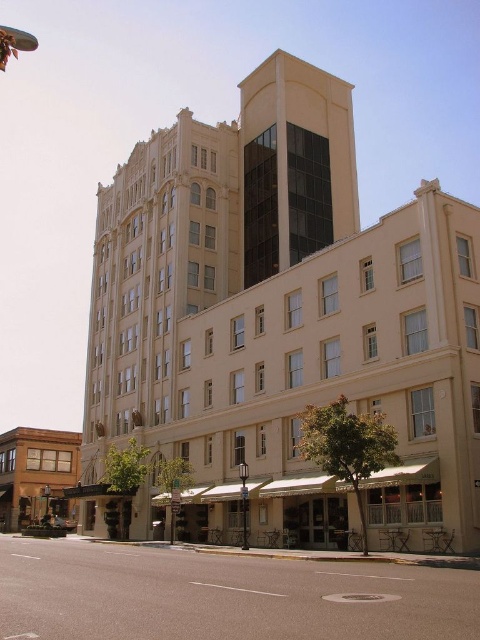
You are standing at the entrance of the building and want to walk towards the point labeled as point (37, 445). However, there is an obstacle at point (147, 513). Based on the image description, is the obstacle blocking your path to the destination?

Yes, the obstacle at point (147, 513) is blocking your path to the destination because point (147, 513) is in front of point (37, 445).

You are standing on the street looking at the beige stone building at center and the brown wooden building at lower left. Which building is positioned higher up in the image?

The beige stone building at center is located above the brown wooden building at lower left, so it is positioned higher up in the image.

Looking at this image, you are standing in front of the building and want to reach a point marked at coordinates point [404,461]. If your current position is 100 feet away from the building, can you reach the point without moving closer than 100 feet to the building?

The distance of point [404,461] from camera is 145.20 feet, so you are currently 100 feet away from the building. Since the point is 145.20 feet away from the camera, which is further than your current distance, you can reach the point without moving closer than 100 feet to the building.